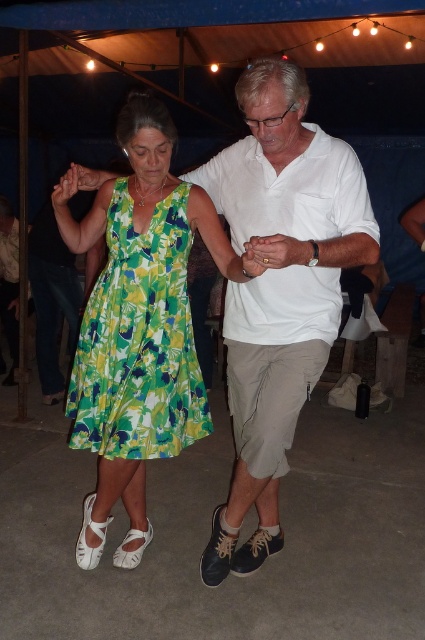
You are a photographer at the event and want to capture a closeup shot of the green floral dress at left and the green floral fabric dress at left. However, your camera lens has a maximum width capacity of 1 meter. Can both dresses fit within the frame without cropping?

The green floral dress at left is wider than the green floral fabric dress at left. Since the camera lens has a maximum width capacity of 1 meter, but the exact widths of the dresses are not provided, it is unclear if both can fit without cropping. Additional information about their specific widths is needed to determine this.

Based on the photo, in the scene, you see a white cotton shirt at center and a green floral fabric dress at left. Which one is positioned more to the right side?

The white cotton shirt at center is positioned more to the right side than the green floral fabric dress at left.

You are a photographer at the event and want to capture a photo where the white cotton shirt at center and the green floral fabric dress at left are both clearly visible. Considering their positions, which one should you focus on first to ensure both are in focus?

The white cotton shirt at center is positioned under the green floral fabric dress at left, so focusing on the white cotton shirt at center first will ensure both are in focus since it is closer to the camera.